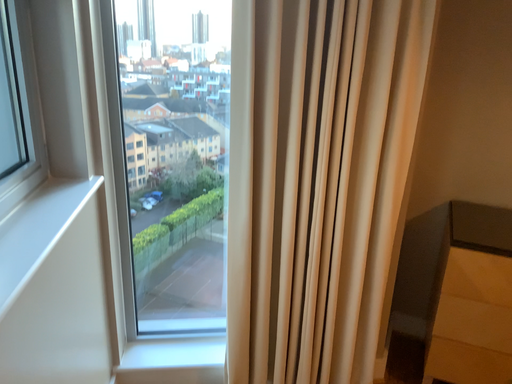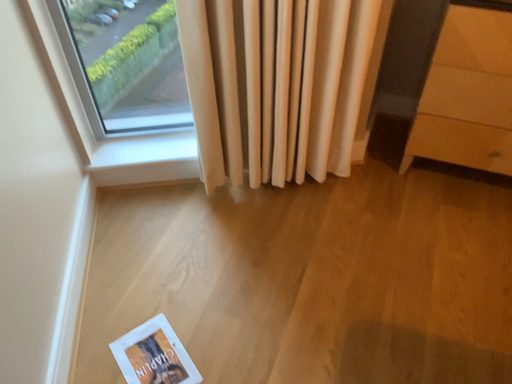
Question: How did the camera likely rotate when shooting the video?

Choices:
 (A) rotated upward
 (B) rotated downward

Answer: (B)